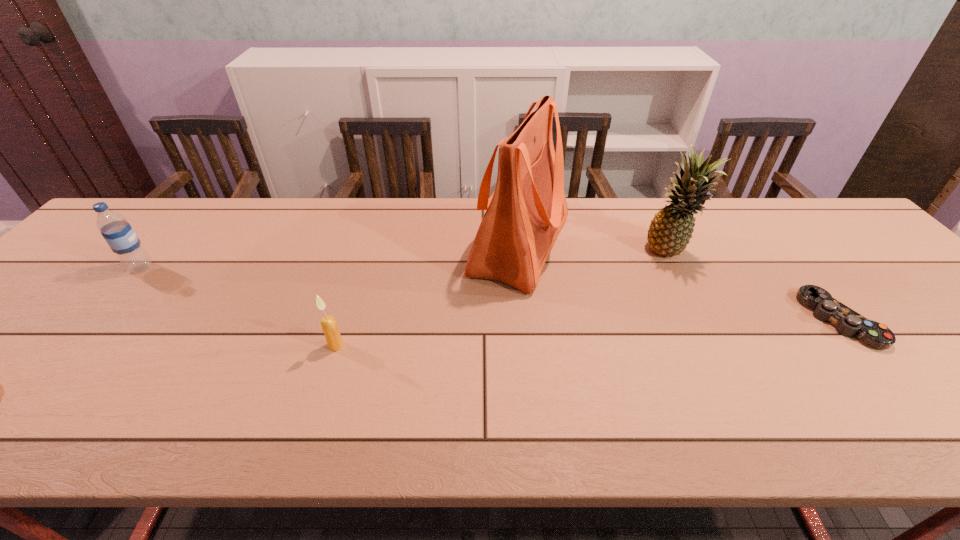
In the image, there is a desktop. Identify the location of vacant space at the right edge. The height and width of the screenshot is (540, 960). (882, 309).

You are a GUI agent. You are given a task and a screenshot of the screen. Output one action in this format:
    pyautogui.click(x=<x>, y=<y>)
    Task: Click on the vacant space at the far left corner of the desktop
    
    Given the screenshot: What is the action you would take?
    pyautogui.click(x=151, y=218)

In the image, there is a desktop. Identify the location of free region at the far right corner. (840, 227).

Where is `free space that is in between the second object from right to left and the water bottle`? free space that is in between the second object from right to left and the water bottle is located at coordinates (405, 260).

You are a GUI agent. You are given a task and a screenshot of the screen. Output one action in this format:
    pyautogui.click(x=<x>, y=<y>)
    Task: Click on the vacant region between the fourth object from left to right and the third object from left to right
    
    Given the screenshot: What is the action you would take?
    pyautogui.click(x=595, y=249)

Where is `free area in between the water bottle and the candle`? The height and width of the screenshot is (540, 960). free area in between the water bottle and the candle is located at coordinates (238, 307).

Identify the location of vacant space that is in between the second shortest object and the control. (588, 333).

Where is `vacant area that lies between the tallest object and the fourth object from left to right`? vacant area that lies between the tallest object and the fourth object from left to right is located at coordinates (595, 249).

Image resolution: width=960 pixels, height=540 pixels. I want to click on free spot between the water bottle and the fourth object from left to right, so click(405, 260).

The image size is (960, 540). In order to click on object that stands as the closest to the pineapple in this screenshot , I will do `click(524, 215)`.